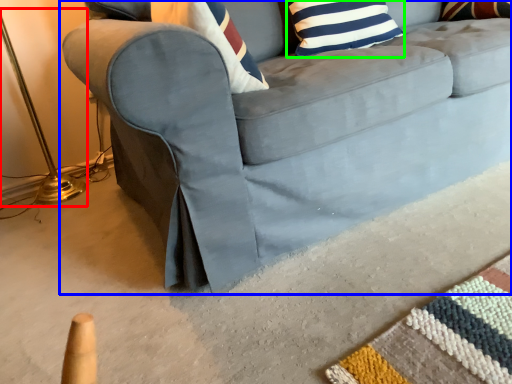
Question: Which object is the closest to the table lamp (highlighted by a red box)? Choose among these: studio couch (highlighted by a blue box) or pillow (highlighted by a green box).

Choices:
 (A) studio couch
 (B) pillow

Answer: (A)